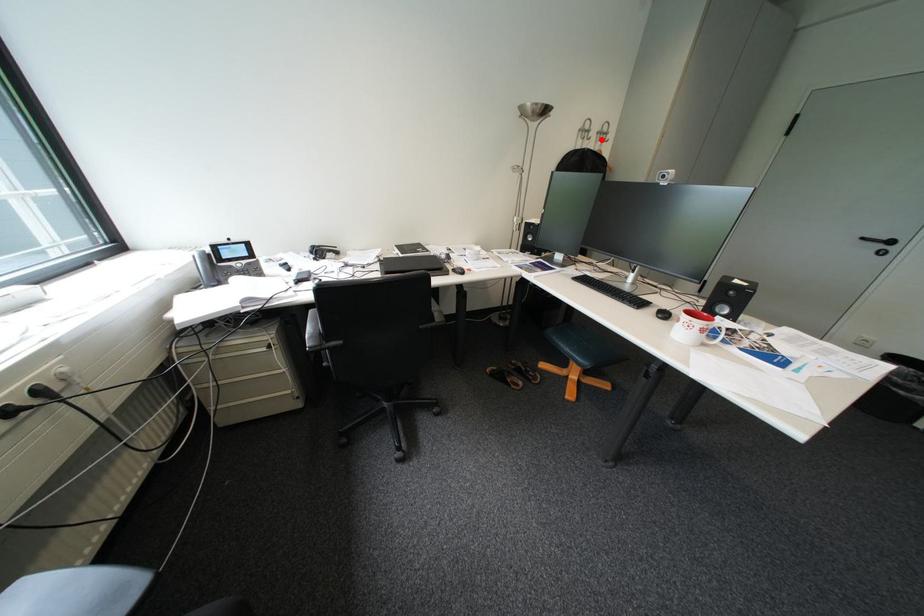
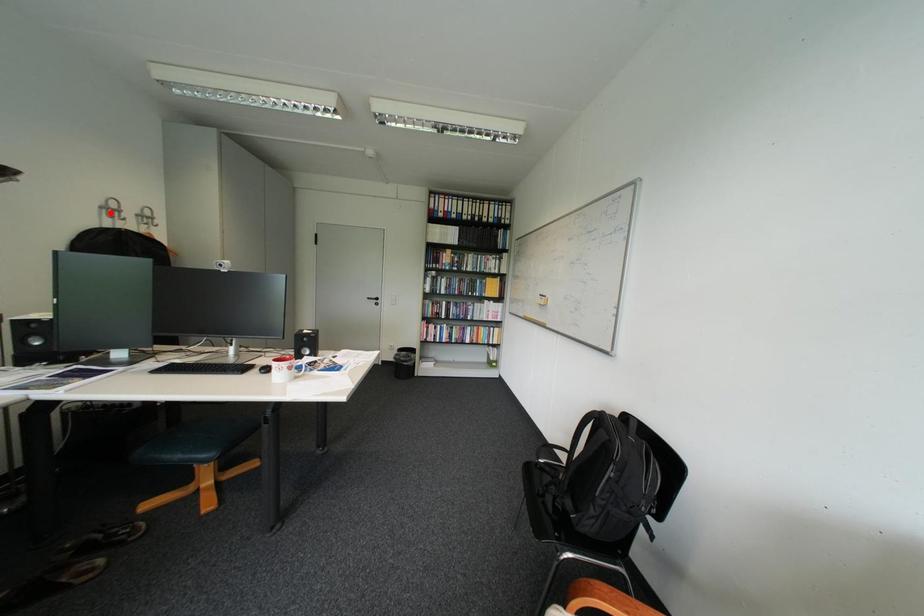
I am providing you with two images of the same scene from different viewpoints. A red point is marked on the first image and another point is marked on the second image. Is the marked point in image1 the same physical position as the marked point in image2?

No